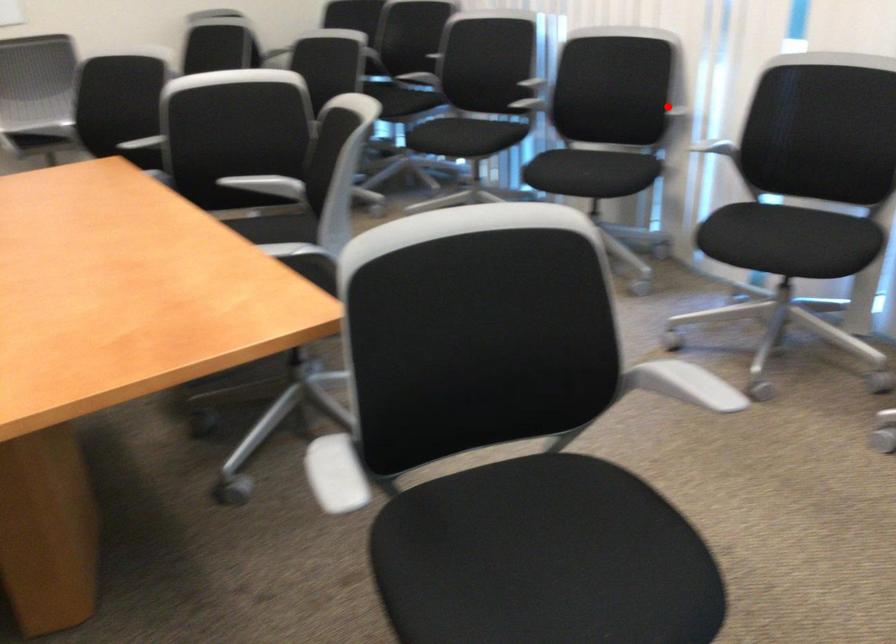
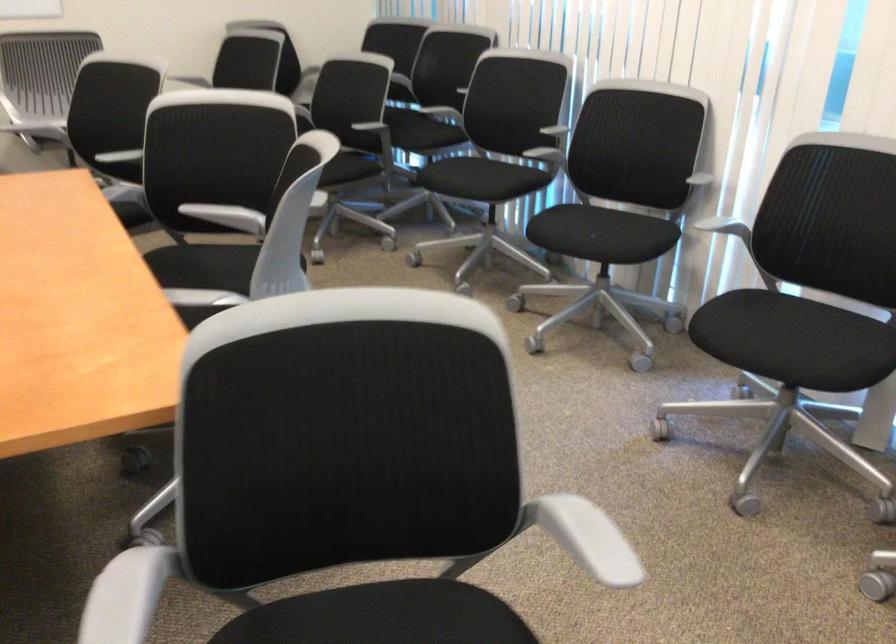
Where in the second image is the point corresponding to the highlighted location from the first image?

(693, 174)